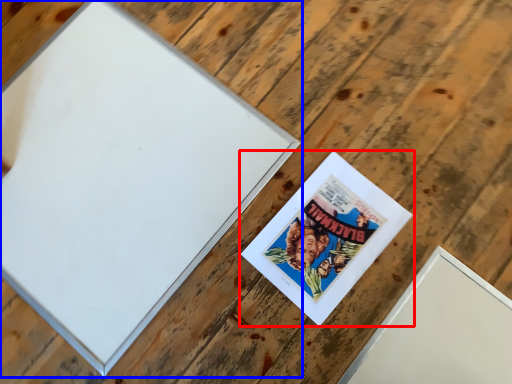
Question: Which of the following is the closest to the observer, picture frame (highlighted by a red box) or picture frame (highlighted by a blue box)?

Choices:
 (A) picture frame
 (B) picture frame

Answer: (B)